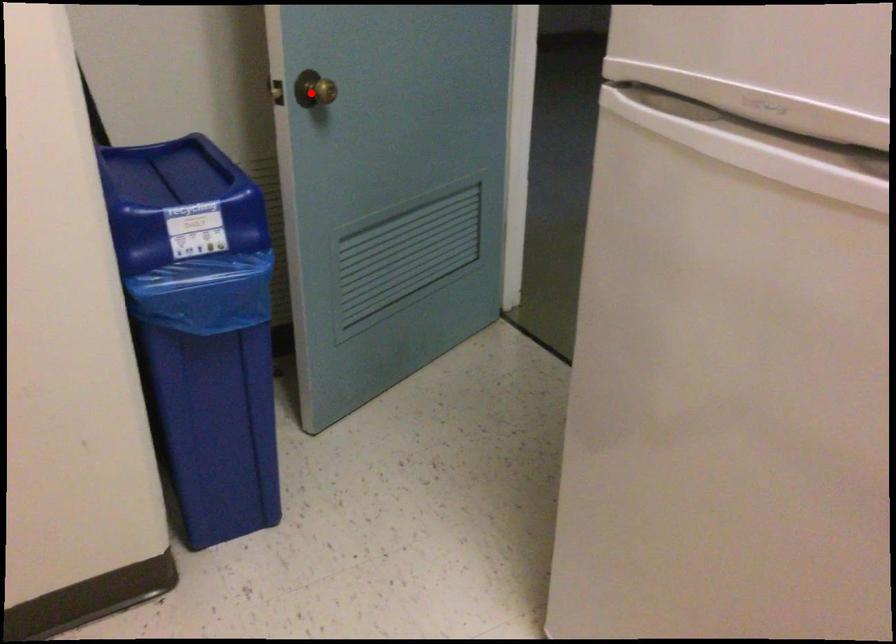
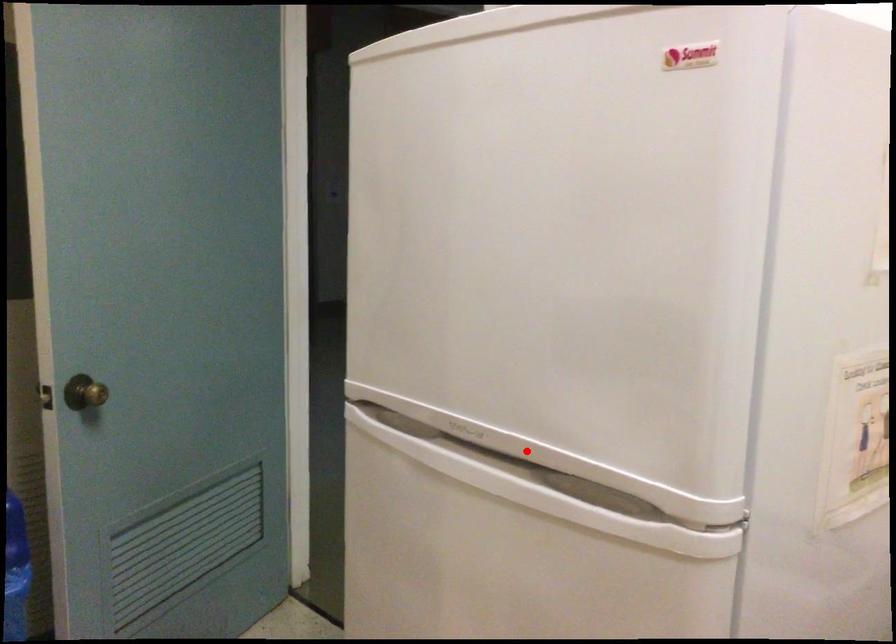
I am providing you with two images of the same scene from different viewpoints. A red point is marked on the first image and another point is marked on the second image. Are the points marked in image1 and image2 representing the same 3D position?

No